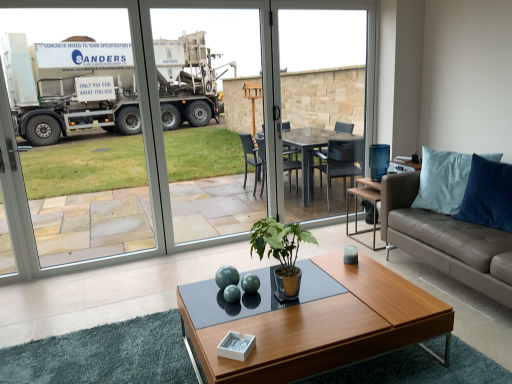
Question: Is transparent glass screen door at center not inside leather couch at right?

Choices:
 (A) no
 (B) yes

Answer: (B)

Question: Considering the relative sizes of transparent glass screen door at center and leather couch at right in the image provided, is transparent glass screen door at center wider than leather couch at right?

Choices:
 (A) no
 (B) yes

Answer: (A)

Question: Does transparent glass screen door at center have a larger size compared to leather couch at right?

Choices:
 (A) no
 (B) yes

Answer: (A)

Question: Is transparent glass screen door at center in contact with leather couch at right?

Choices:
 (A) yes
 (B) no

Answer: (B)

Question: From the image's perspective, is transparent glass screen door at center below leather couch at right?

Choices:
 (A) yes
 (B) no

Answer: (B)

Question: Looking at the image, does wooden coffee table at center seem bigger or smaller compared to green glossy plant at center?

Choices:
 (A) big
 (B) small

Answer: (A)

Question: From the image's perspective, is wooden coffee table at center positioned above or below green glossy plant at center?

Choices:
 (A) above
 (B) below

Answer: (B)

Question: Is wooden coffee table at center taller or shorter than green glossy plant at center?

Choices:
 (A) tall
 (B) short

Answer: (B)

Question: In the image, is wooden coffee table at center on the left side or the right side of green glossy plant at center?

Choices:
 (A) right
 (B) left

Answer: (A)

Question: Considering the positions of leather couch at right and transparent glass table at center in the image, is leather couch at right wider or thinner than transparent glass table at center?

Choices:
 (A) wide
 (B) thin

Answer: (A)

Question: Choose the correct answer: Is leather couch at right inside transparent glass table at center or outside it?

Choices:
 (A) inside
 (B) outside

Answer: (B)

Question: Is leather couch at right to the left or to the right of transparent glass table at center in the image?

Choices:
 (A) left
 (B) right

Answer: (B)

Question: From a real-world perspective, is leather couch at right physically located above or below transparent glass table at center?

Choices:
 (A) below
 (B) above

Answer: (A)

Question: Considering the positions of transparent glass screen door at center and leather couch at right in the image, is transparent glass screen door at center bigger or smaller than leather couch at right?

Choices:
 (A) small
 (B) big

Answer: (A)

Question: Looking at their shapes, would you say transparent glass screen door at center is wider or thinner than leather couch at right?

Choices:
 (A) wide
 (B) thin

Answer: (B)